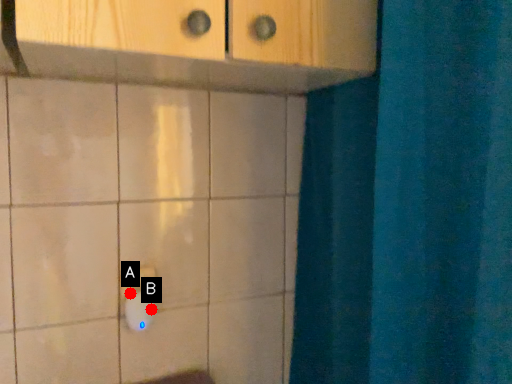
Question: Two points are circled on the image, labeled by A and B beside each circle. Which point appears closest to the camera in this image?

Choices:
 (A) A is closer
 (B) B is closer

Answer: (B)